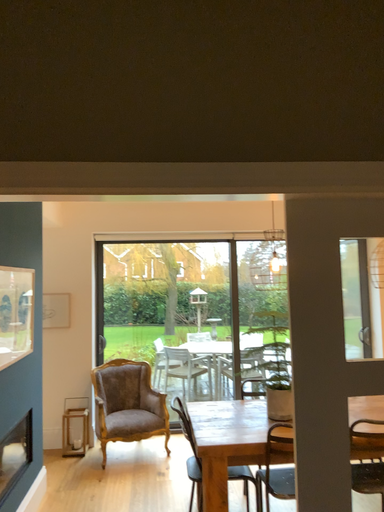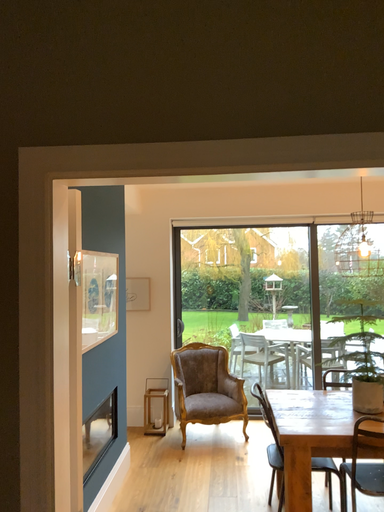
Question: Which way did the camera rotate in the video?

Choices:
 (A) rotated left
 (B) rotated right

Answer: (A)